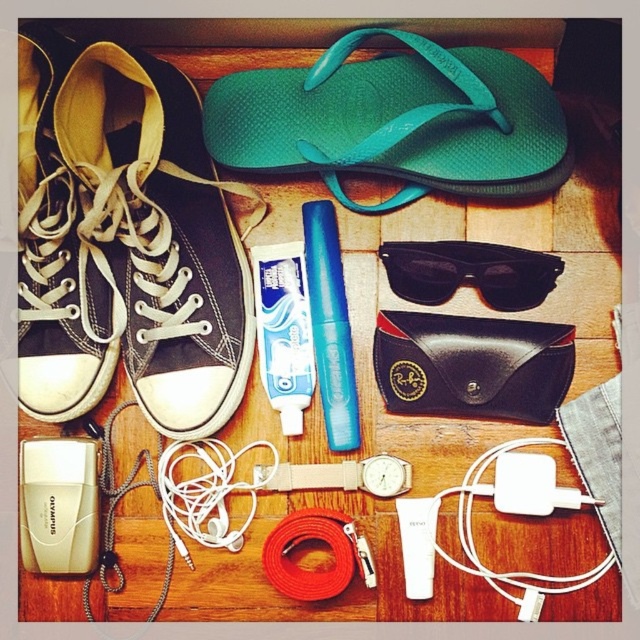
Question: From the image, what is the correct spatial relationship of teal rubber flip-flop at upper center in relation to black leather glasses case at center?

Choices:
 (A) below
 (B) above

Answer: (B)

Question: Which point is farther to the camera?

Choices:
 (A) black canvas shoe at upper left
 (B) white plastic ipod at lower center
 (C) black matte sunglasses at center
 (D) matte black sneaker at left

Answer: (B)

Question: Is matte black sneaker at left above white plastic power adapter at lower right?

Choices:
 (A) yes
 (B) no

Answer: (A)

Question: Which object is closer to the camera taking this photo?

Choices:
 (A) matte black sneaker at left
 (B) black leather glasses case at center
 (C) white plastic ipod at lower left

Answer: (A)

Question: Which of the following is the farthest from the observer?

Choices:
 (A) (38, 33)
 (B) (509, 140)
 (C) (465, 266)
 (D) (508, 477)

Answer: (C)

Question: Is teal rubber flip-flop at upper center closer to the viewer compared to white plastic ipod at lower center?

Choices:
 (A) yes
 (B) no

Answer: (A)